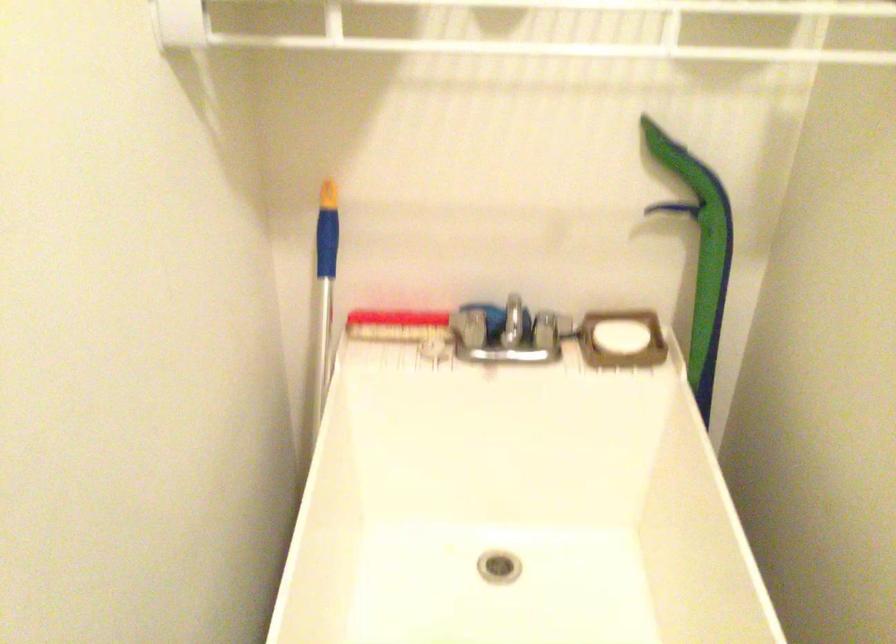
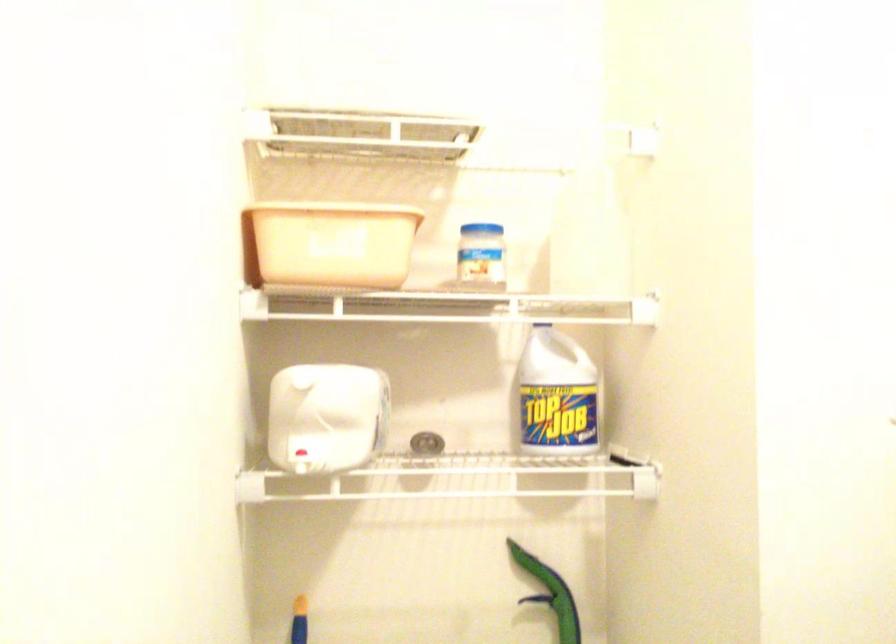
Find the pixel in the second image that matches point 693,205 in the first image.

(552, 594)